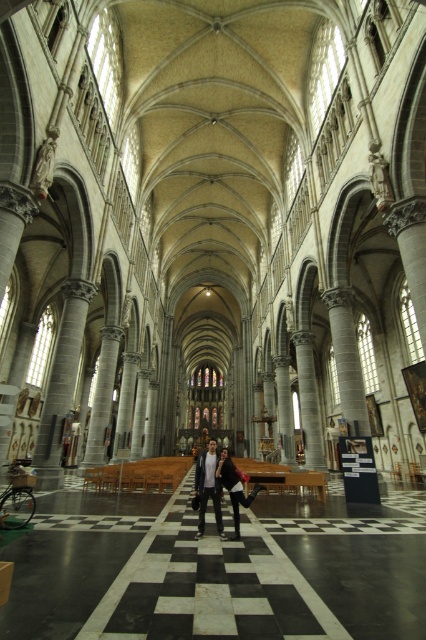
Question: Is matte black jacket at center positioned behind white shirt at center?

Choices:
 (A) yes
 (B) no

Answer: (B)

Question: Is matte black jacket at center to the right of white shirt at center from the viewer's perspective?

Choices:
 (A) yes
 (B) no

Answer: (A)

Question: Does matte black jacket at center have a greater width compared to white shirt at center?

Choices:
 (A) no
 (B) yes

Answer: (B)

Question: Among these objects, which one is nearest to the camera?

Choices:
 (A) white shirt at center
 (B) matte black jacket at center

Answer: (B)

Question: Which object appears closest to the camera in this image?

Choices:
 (A) matte black jacket at center
 (B) white shirt at center

Answer: (A)

Question: Which point appears closest to the camera in this image?

Choices:
 (A) (195, 476)
 (B) (245, 497)

Answer: (B)